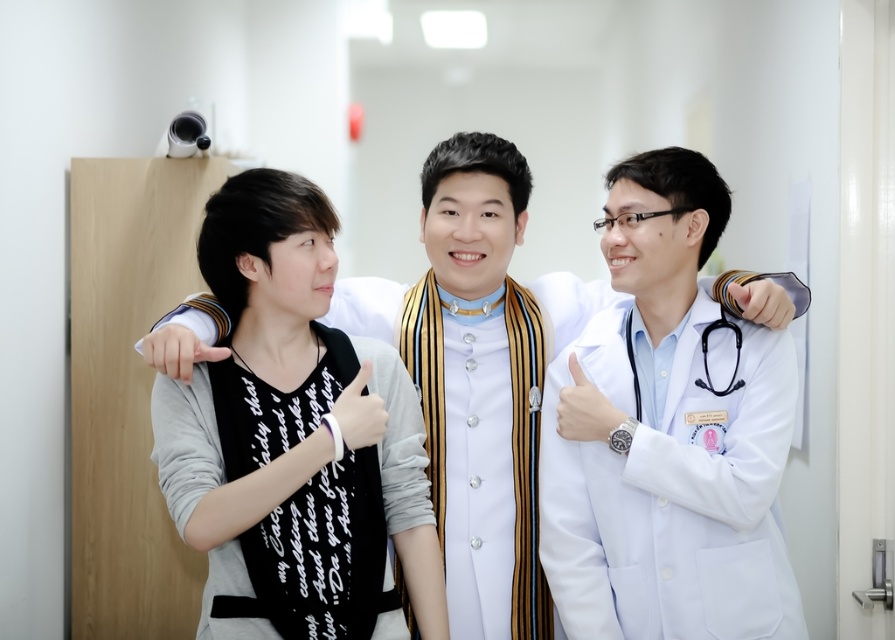
You are a photographer in the hospital corridor. You need to position the black matte shirt at center and the black rubber stethoscope at center so that the stethoscope is visible in the photo. Based on their positions, which object should be placed closer to the camera to ensure the stethoscope is in focus?

The black rubber stethoscope at center should be placed closer to the camera because the black matte shirt at center is to the left of it, so moving the stethoscope forward would keep it in focus while the shirt remains in the frame.

You are a photographer preparing to take a group photo of the three individuals in the medical setting. You need to ensure that the white matte lab coat at center and the white matte hand at center are both visible in the frame. Given their size difference, which object should you prioritize positioning closer to the camera to maintain their visibility in the photo?

Since the white matte lab coat at center is larger than the white matte hand at center, you should position the white matte hand at center closer to the camera to ensure both are visible in the frame.

You are a photographer taking a picture of the scene. The black matte shirt at center and white matte watch at center are both in the frame. Which object is positioned lower in the image?

The black matte shirt at center is below the white matte watch at center, so the black matte shirt at center is positioned lower in the image.